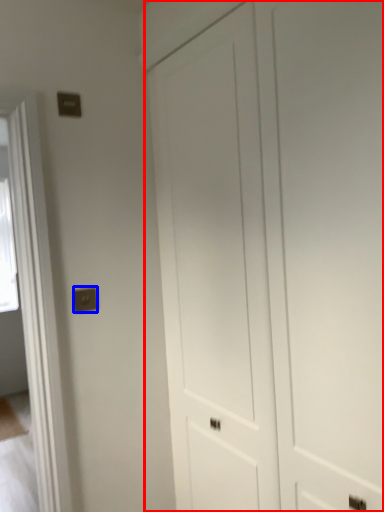
Question: Which of the following is the closest to the observer, door (highlighted by a red box) or electric outlet (highlighted by a blue box)?

Choices:
 (A) door
 (B) electric outlet

Answer: (A)